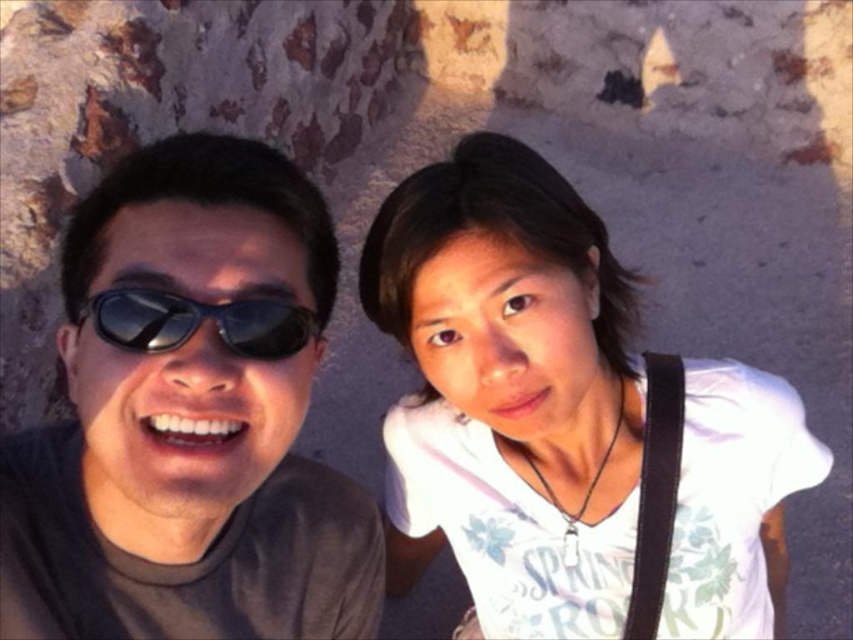
Does matte black sunglasses at left have a lesser width compared to black reflective sunglasses at left?

In fact, matte black sunglasses at left might be wider than black reflective sunglasses at left.

Describe the element at coordinates (189, 417) in the screenshot. Image resolution: width=853 pixels, height=640 pixels. I see `matte black sunglasses at left` at that location.

Identify the location of matte black sunglasses at left. The width and height of the screenshot is (853, 640). (189, 417).

Who is taller, white matte shirt at center or black reflective sunglasses at left?

Standing taller between the two is white matte shirt at center.

Is point (515, 244) positioned in front of point (177, 333)?

That is False.

Image resolution: width=853 pixels, height=640 pixels. I want to click on white matte shirt at center, so click(x=509, y=392).

Does matte black sunglasses at left have a greater width compared to white matte shirt at center?

No, matte black sunglasses at left is not wider than white matte shirt at center.

Can you confirm if matte black sunglasses at left is bigger than white matte shirt at center?

Incorrect, matte black sunglasses at left is not larger than white matte shirt at center.

Is point (183, 384) farther from camera compared to point (744, 452)?

No.

Locate an element on the screen. matte black sunglasses at left is located at coordinates (189, 417).